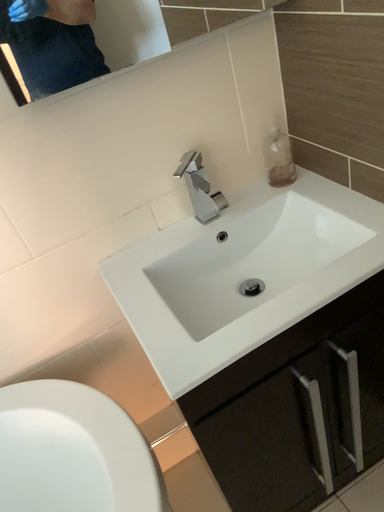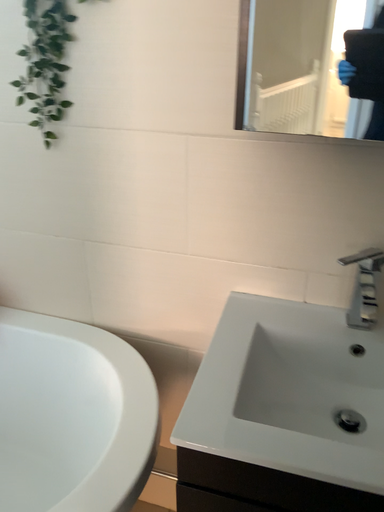
Question: Which way did the camera rotate in the video?

Choices:
 (A) rotated left
 (B) rotated right

Answer: (A)